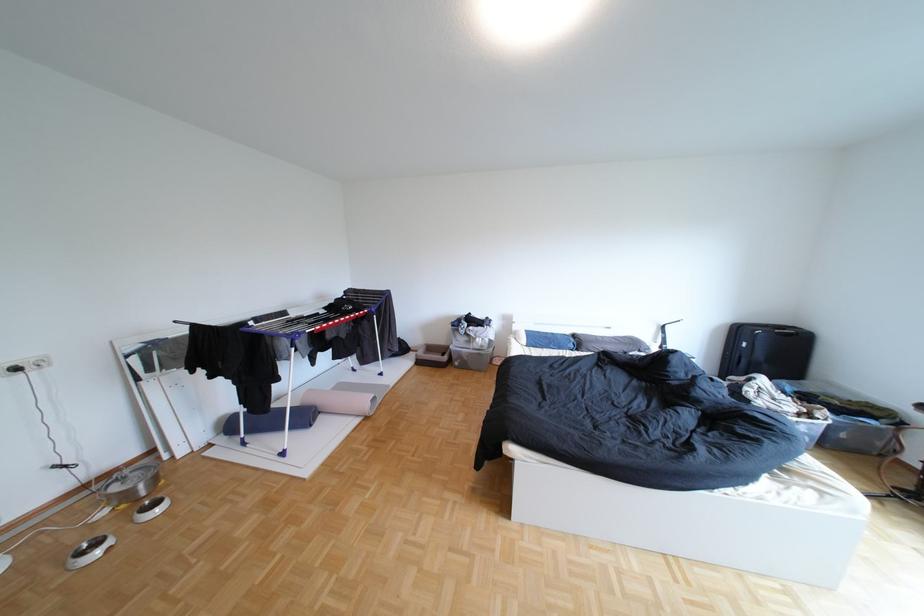
Where is `metal pot lid handle`? The height and width of the screenshot is (616, 924). metal pot lid handle is located at coordinates (129, 484).